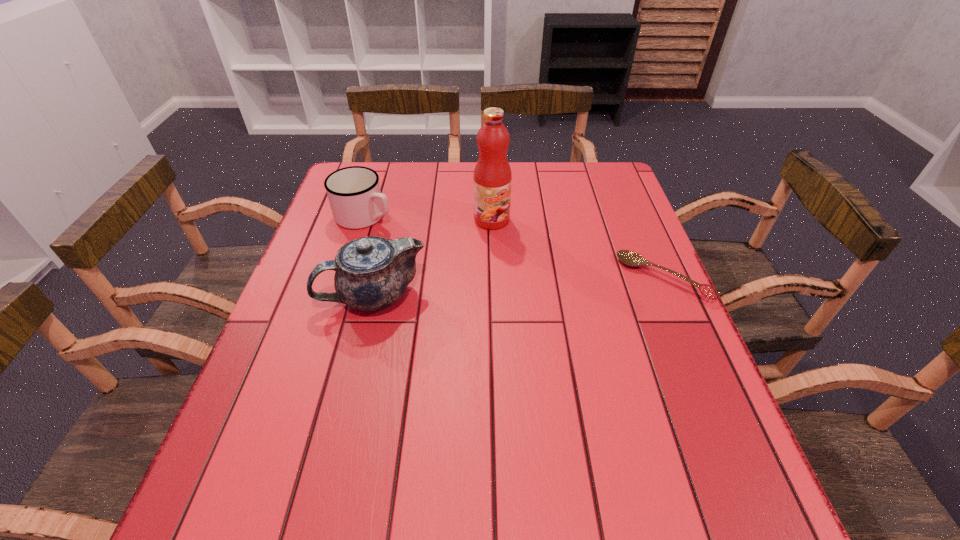
Image resolution: width=960 pixels, height=540 pixels. In order to click on free location located 0.050m on the side of the mug with the handle in this screenshot , I will do `click(402, 230)`.

Identify the location of vacant space located on the front label of the fruit juice. (524, 258).

You are a GUI agent. You are given a task and a screenshot of the screen. Output one action in this format:
    pyautogui.click(x=<x>, y=<y>)
    Task: Click on the vacant area situated 0.140m on the front label of the fruit juice
    The height and width of the screenshot is (540, 960).
    Given the screenshot: What is the action you would take?
    pyautogui.click(x=526, y=260)

Locate an element on the screen. free spot located on the front label of the fruit juice is located at coordinates (585, 328).

Where is `object present at the far edge`? The image size is (960, 540). object present at the far edge is located at coordinates (354, 194).

This screenshot has width=960, height=540. Find the location of `chinaware that is at the left edge`. chinaware that is at the left edge is located at coordinates (371, 273).

The height and width of the screenshot is (540, 960). I want to click on mug situated at the left edge, so click(x=354, y=194).

You are a GUI agent. You are given a task and a screenshot of the screen. Output one action in this format:
    pyautogui.click(x=<x>, y=<y>)
    Task: Click on the object present at the right edge
    This screenshot has height=540, width=960.
    Given the screenshot: What is the action you would take?
    pyautogui.click(x=630, y=258)

Locate an element on the screen. The image size is (960, 540). object that is at the far left corner is located at coordinates (354, 194).

Find the location of `free space at the far edge of the desktop`. free space at the far edge of the desktop is located at coordinates (522, 168).